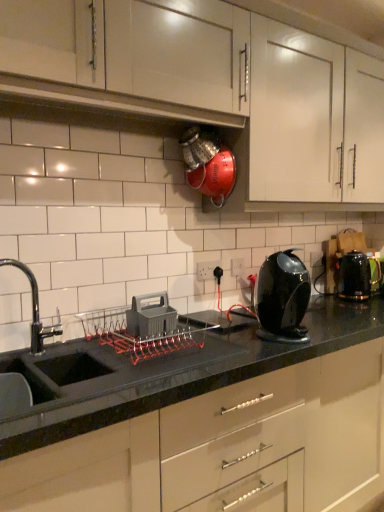
Question: Considering the relative sizes of black glossy kettle at right and white glossy cabinet at upper center, the 3th cabinetry from the bottom, in the image provided, is black glossy kettle at right smaller than white glossy cabinet at upper center, the 3th cabinetry from the bottom,?

Choices:
 (A) no
 (B) yes

Answer: (B)

Question: Can you confirm if black glossy kettle at right is positioned to the left of white glossy cabinet at upper center, the 3th cabinetry from the bottom?

Choices:
 (A) no
 (B) yes

Answer: (A)

Question: From a real-world perspective, is black glossy kettle at right below white glossy cabinet at upper center, the 3th cabinetry from the bottom?

Choices:
 (A) yes
 (B) no

Answer: (A)

Question: Is black glossy kettle at right in front of white glossy cabinet at upper center, which is the 1th cabinetry from top to bottom?

Choices:
 (A) no
 (B) yes

Answer: (A)

Question: Is black glossy kettle at right outside of white glossy cabinet at upper center, the 3th cabinetry from the bottom?

Choices:
 (A) no
 (B) yes

Answer: (B)

Question: In the image, is black plastic electric outlet at center, which is counted as the first electric outlet, starting from the right, on the left side or the right side of glossy black kettle at center-right?

Choices:
 (A) left
 (B) right

Answer: (A)

Question: Is point (238, 269) closer or farther from the camera than point (292, 314)?

Choices:
 (A) closer
 (B) farther

Answer: (B)

Question: Considering their positions, is black plastic electric outlet at center, which is counted as the first electric outlet, starting from the right, located in front of or behind glossy black kettle at center-right?

Choices:
 (A) front
 (B) behind

Answer: (B)

Question: From a real-world perspective, is black plastic electric outlet at center, the first electric outlet in the back-to-front sequence, physically located above or below glossy black kettle at center-right?

Choices:
 (A) below
 (B) above

Answer: (B)

Question: In terms of size, does glossy black kettle at center-right appear bigger or smaller than black plastic electric outlet at center, which ranks as the 2th electric outlet in front-to-back order?

Choices:
 (A) big
 (B) small

Answer: (A)

Question: From the image's perspective, relative to black plastic electric outlet at center, the first electric outlet in the back-to-front sequence, is glossy black kettle at center-right above or below?

Choices:
 (A) below
 (B) above

Answer: (A)

Question: From their relative heights in the image, would you say glossy black kettle at center-right is taller or shorter than black plastic electric outlet at center, which is counted as the first electric outlet, starting from the right?

Choices:
 (A) short
 (B) tall

Answer: (B)

Question: From a real-world perspective, relative to black plastic electric outlet at center, which is counted as the first electric outlet, starting from the right, is glossy black kettle at center-right vertically above or below?

Choices:
 (A) below
 (B) above

Answer: (A)

Question: From their relative heights in the image, would you say glossy black kettle at center-right is taller or shorter than white glossy cabinet at upper center, which is the 1th cabinetry from top to bottom?

Choices:
 (A) short
 (B) tall

Answer: (A)

Question: Is glossy black kettle at center-right situated inside white glossy cabinet at upper center, which is the 1th cabinetry from top to bottom, or outside?

Choices:
 (A) outside
 (B) inside

Answer: (A)